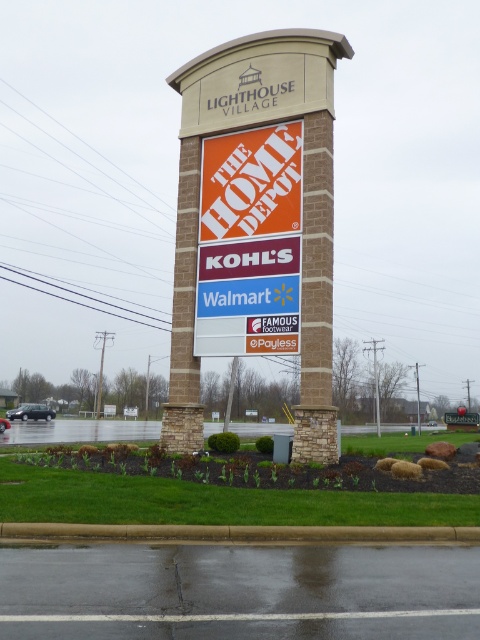
Question: Observing the image, what is the correct spatial positioning of matte orange sign at center in reference to metallic pole at center?

Choices:
 (A) right
 (B) left

Answer: (A)

Question: Does matte orange sign at center appear on the right side of black rubber car at center?

Choices:
 (A) yes
 (B) no

Answer: (A)

Question: Does orangematerialsignage at center have a smaller size compared to metallic pole at center?

Choices:
 (A) yes
 (B) no

Answer: (A)

Question: Which of the following is the farthest from the observer?

Choices:
 (A) (2, 429)
 (B) (51, 412)
 (C) (474, 417)
 (D) (231, 349)

Answer: (B)

Question: Considering the real-world distances, which object is closest to the black matte car at lower left?

Choices:
 (A) matte orange sign at center
 (B) black rubber car at center
 (C) metallic pole at center

Answer: (B)

Question: Which point is farther to the camera?

Choices:
 (A) black rubber car at center
 (B) metallic pole at center
 (C) black matte car at lower left
 (D) orangematerialsignage at center

Answer: (C)